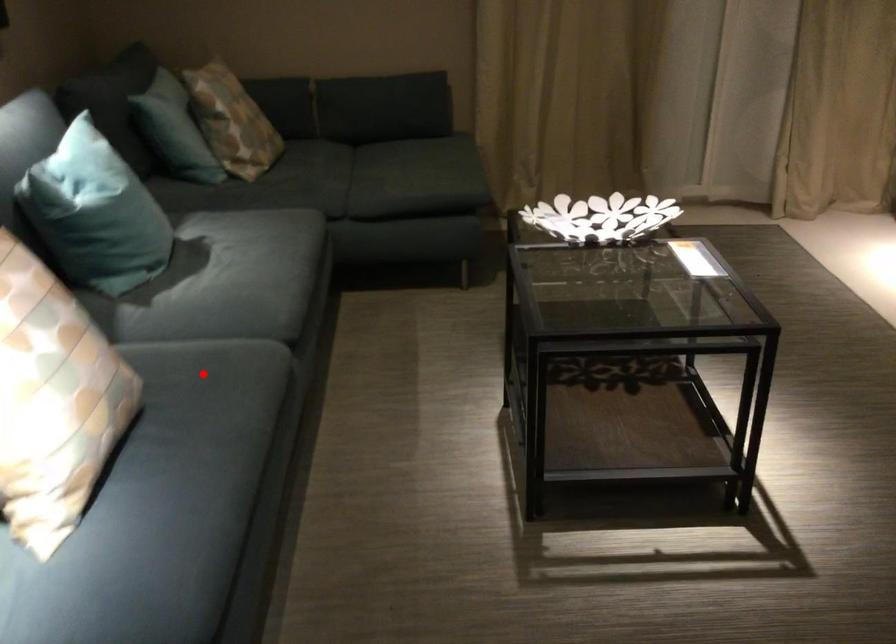
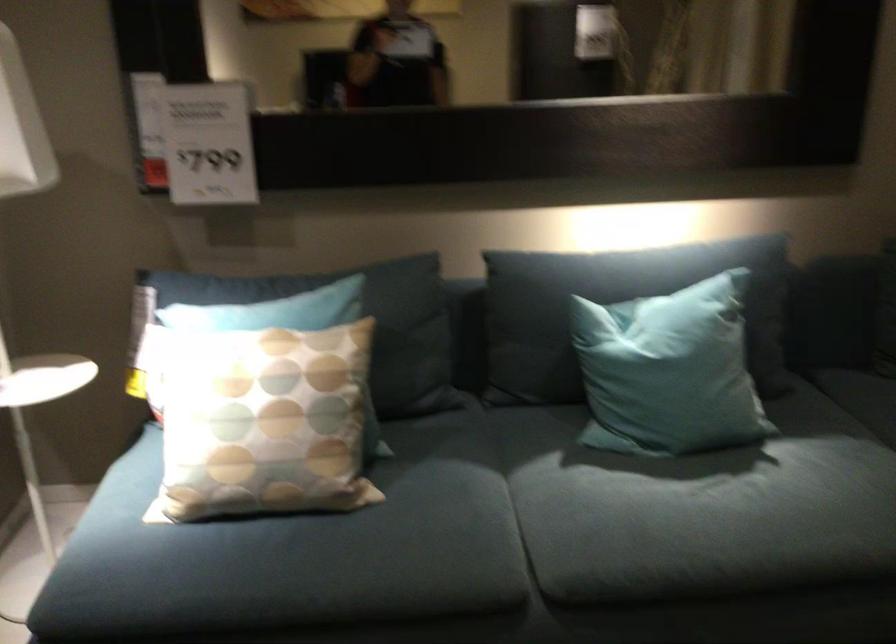
In the second image, find the point that corresponds to the highlighted location in the first image.

(406, 526)